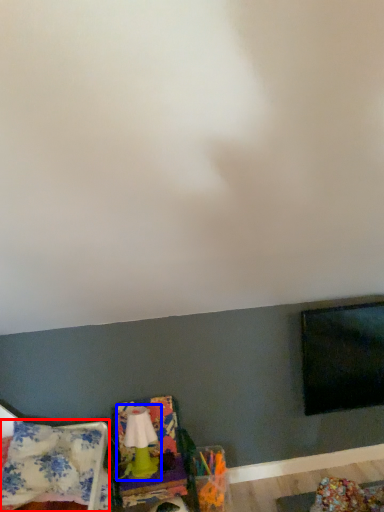
Question: Which object appears farthest to the camera in this image, blanket (highlighted by a red box) or lamp (highlighted by a blue box)?

Choices:
 (A) blanket
 (B) lamp

Answer: (B)